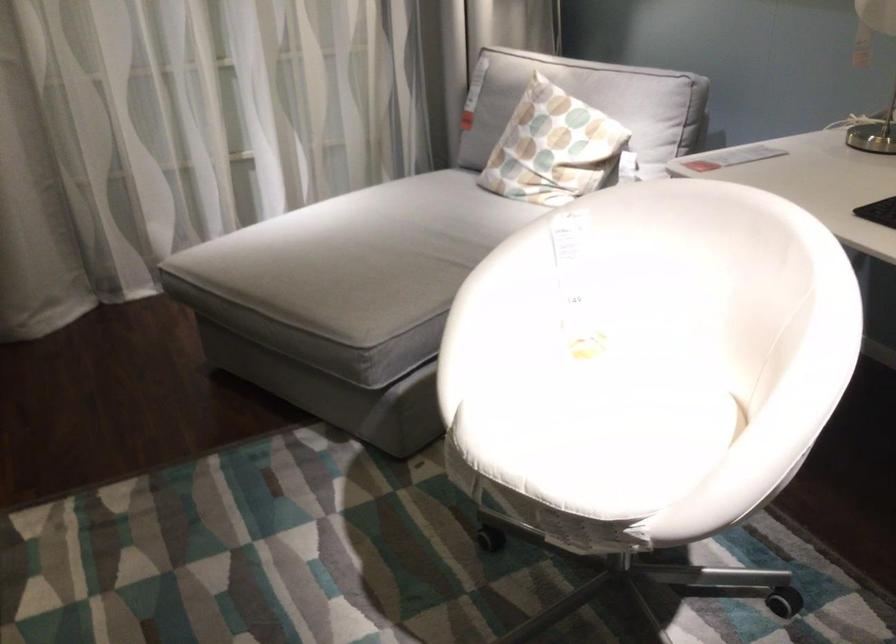
Find the location of `white chair armrest`. white chair armrest is located at coordinates (x=780, y=399).